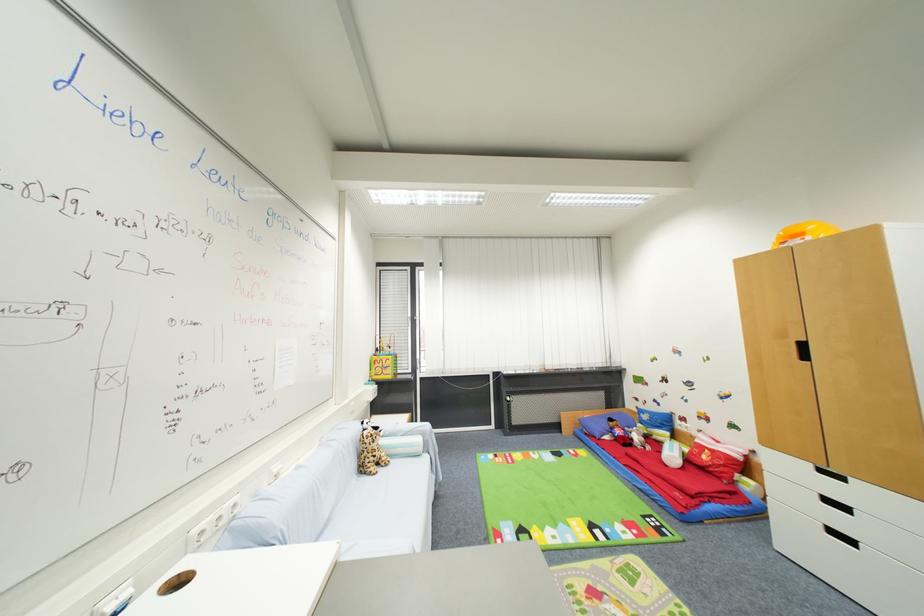
The width and height of the screenshot is (924, 616). What do you see at coordinates (803, 351) in the screenshot?
I see `a black cabinet handle` at bounding box center [803, 351].